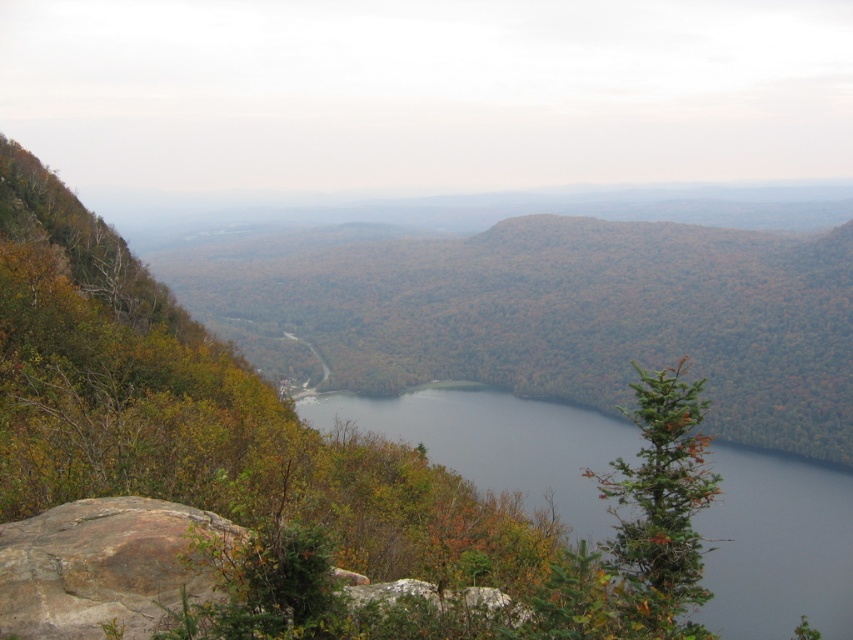
You are a hiker standing at the edge of the valley. You see the dark blue water at center and the brown rough rock at lower left. Which object appears higher in the image?

The dark blue water at center appears higher than the brown rough rock at lower left because it is taller than it.

You are a hiker standing at the brown rough rock at lower left and want to reach the dark blue water at center. Which direction should you move to get there?

You should move downward from the brown rough rock at lower left to reach the dark blue water at center since the dark blue water at center is located below the brown rough rock at lower left.